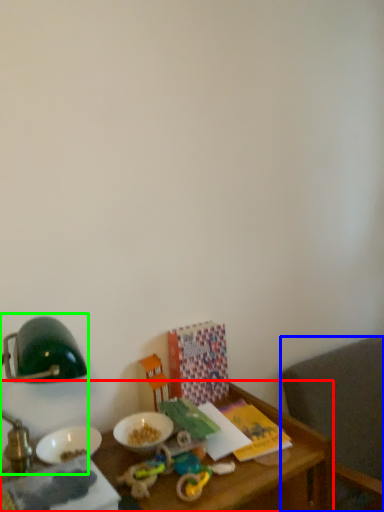
Question: Which is nearer to the table (highlighted by a red box)? chair (highlighted by a blue box) or bedside lamp (highlighted by a green box).

Choices:
 (A) chair
 (B) bedside lamp

Answer: (B)